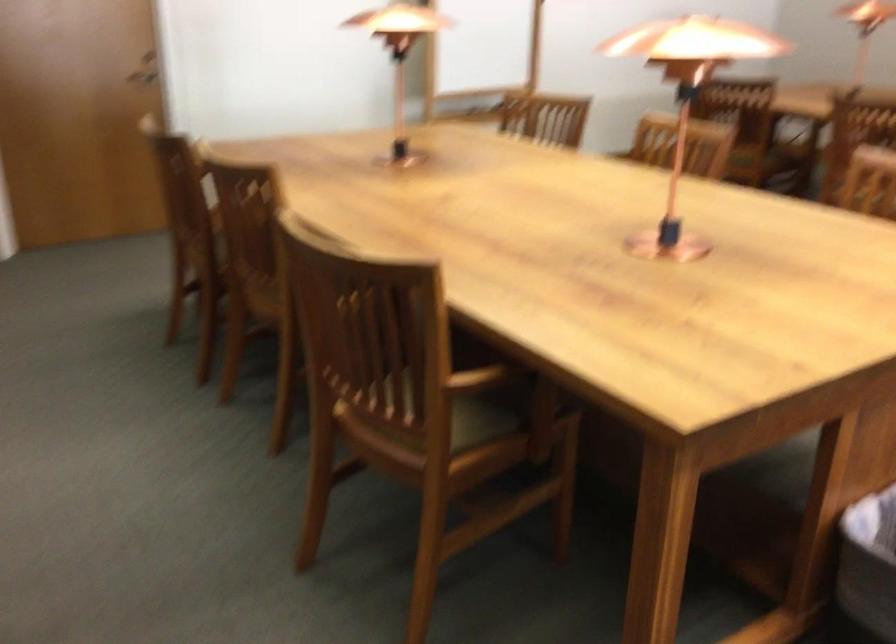
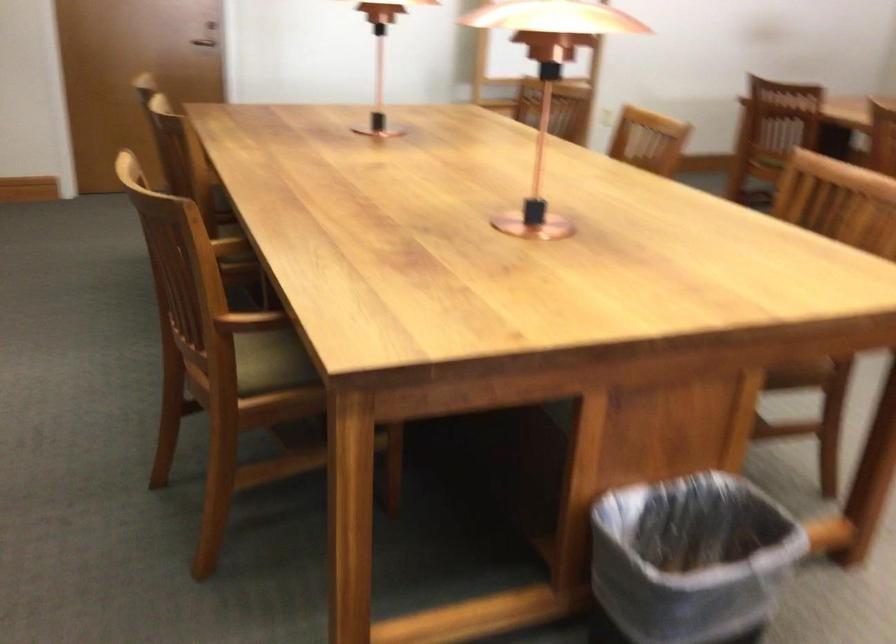
Where in the second image is the point corresponding to point 748,154 from the first image?

(767, 162)